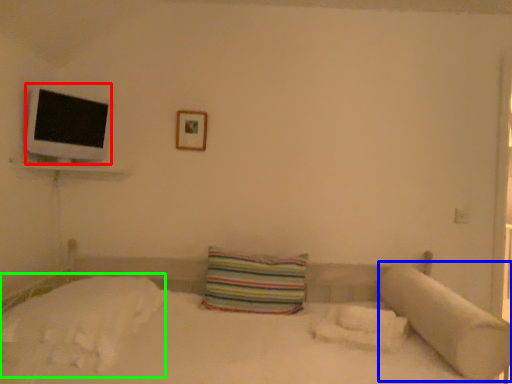
Question: Considering the real-world distances, which object is closest to flat (highlighted by a red box)? pillow (highlighted by a blue box) or sheet (highlighted by a green box).

Choices:
 (A) pillow
 (B) sheet

Answer: (B)